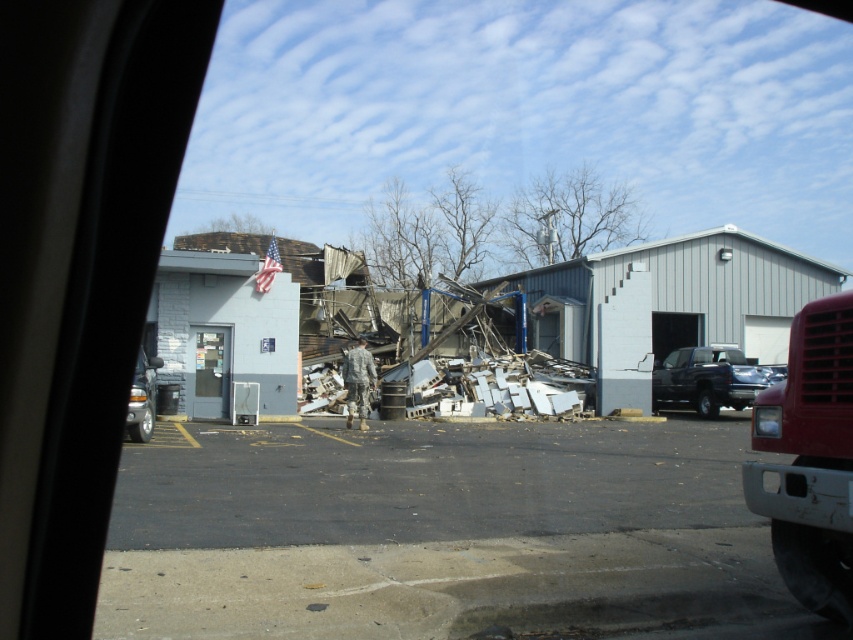
Does matte black truck at right have a smaller size compared to matte silver truck at left?

No.

Find the location of a particular element. This screenshot has width=853, height=640. matte black truck at right is located at coordinates (706, 380).

Is matte silver truck at left above clear glass vending machine at center?

Actually, matte silver truck at left is below clear glass vending machine at center.

Which is in front, point (148, 400) or point (212, 381)?

Point (148, 400)

Between point (128, 404) and point (200, 374), which one is positioned behind?

Positioned behind is point (200, 374).

The height and width of the screenshot is (640, 853). Find the location of `matte silver truck at left`. matte silver truck at left is located at coordinates (142, 397).

Is gray asphalt parking lot at center to the right of clear glass vending machine at center from the viewer's perspective?

Correct, you'll find gray asphalt parking lot at center to the right of clear glass vending machine at center.

In the scene shown: Is gray asphalt parking lot at center behind clear glass vending machine at center?

No, it is in front of clear glass vending machine at center.

Is point (509, 428) farther from camera compared to point (219, 365)?

That is False.

Image resolution: width=853 pixels, height=640 pixels. Find the location of `gray asphalt parking lot at center`. gray asphalt parking lot at center is located at coordinates (442, 532).